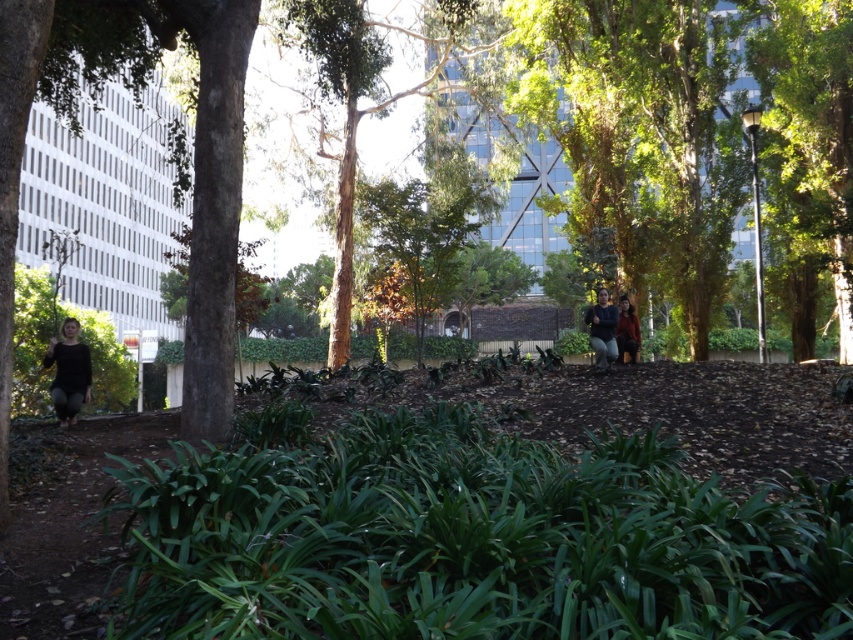
You are a fashion designer observing the urban park scene. You notice the matte black pants at lower left and the matte brown jacket at center. Which item of clothing appears bigger in the image?

The matte black pants at lower left is larger in size than the matte brown jacket at center, so the matte black pants at lower left appears bigger in the image.

From the picture: You are an artist setting up your easel in the park. You want to paint both the smooth bark tree at center and the brown leather jacket at center. Since you want to emphasize their sizes in your painting, which object should you depict as larger?

The smooth bark tree at center should be depicted as larger because it is much taller than the brown leather jacket at center.

You are standing in the park and want to place a 12 meter long banner between the smooth bark tree at center and the brown leather jacket at center. Will the banner be long enough to stretch between them?

The smooth bark tree at center and the brown leather jacket at center are 11.74 meters apart from each other. Since the banner is 12 meters long, it will be long enough to stretch between them with some extra length remaining.